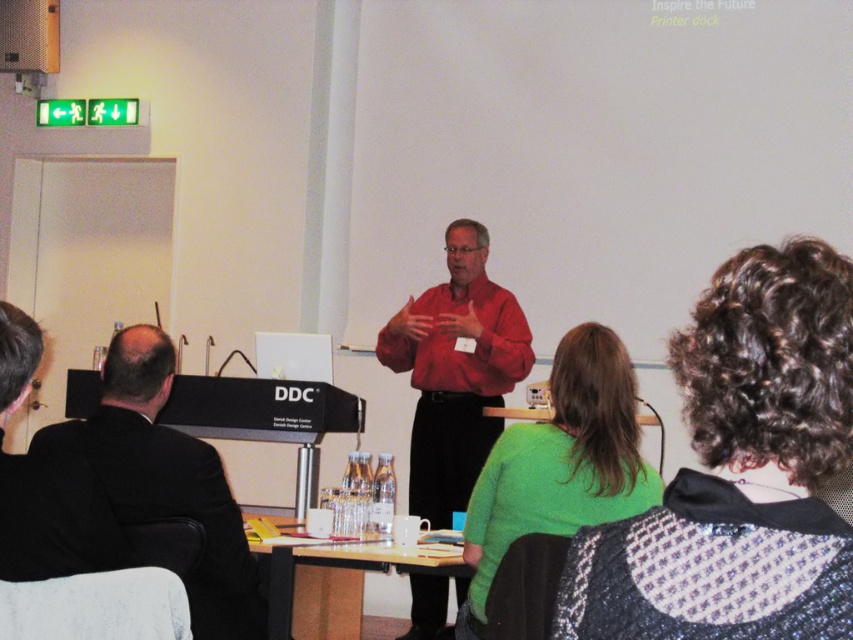
In the scene shown: Is matte red shirt at center taller than wooden table at lower center?

Yes, matte red shirt at center is taller than wooden table at lower center.

Between point (432, 294) and point (335, 637), which one is positioned behind?

Point (432, 294)

I want to click on matte red shirt at center, so click(456, 371).

Is point (238, 561) positioned after point (340, 573)?

No, (238, 561) is closer to viewer.

Image resolution: width=853 pixels, height=640 pixels. In order to click on black suit at left in this screenshot , I will do `click(165, 480)`.

Is matte red shirt at center in front of black suit at left?

That is False.

At what (x,y) coordinates should I click in order to perform the action: click on matte red shirt at center. Please return your answer as a coordinate pair (x, y). Looking at the image, I should click on (456, 371).

Find the location of a particular element. matte red shirt at center is located at coordinates (456, 371).